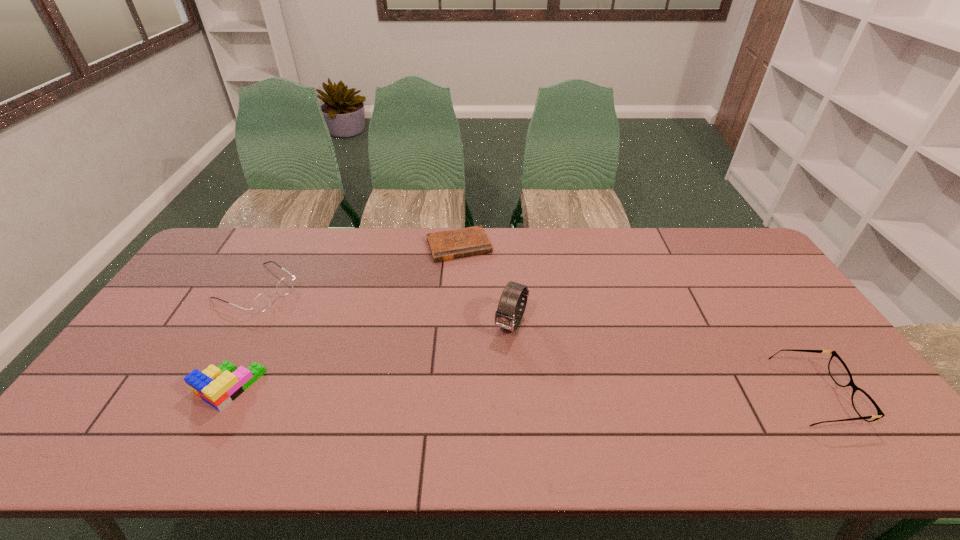
Locate which object ranks second in proximity to the tallest object. Please provide its 2D coordinates. Your answer should be formatted as a tuple, i.e. [(x, y)], where the tuple contains the x and y coordinates of a point satisfying the conditions above.

[(218, 386)]

Where is `free point that satisfies the following two spatial constraints: 1. on the front side of the Lego; 2. on the left side of the left spectacles`? This screenshot has width=960, height=540. free point that satisfies the following two spatial constraints: 1. on the front side of the Lego; 2. on the left side of the left spectacles is located at coordinates (x=202, y=387).

At what (x,y) coordinates should I click in order to perform the action: click on free space that satisfies the following two spatial constraints: 1. on the back side of the shortest object; 2. on the left side of the farther spectacles. Please return your answer as a coordinate pair (x, y). This screenshot has height=540, width=960. Looking at the image, I should click on coord(281,246).

The height and width of the screenshot is (540, 960). I want to click on free space in the image that satisfies the following two spatial constraints: 1. on the front side of the right spectacles; 2. on the front-facing side of the tallest object, so click(516, 396).